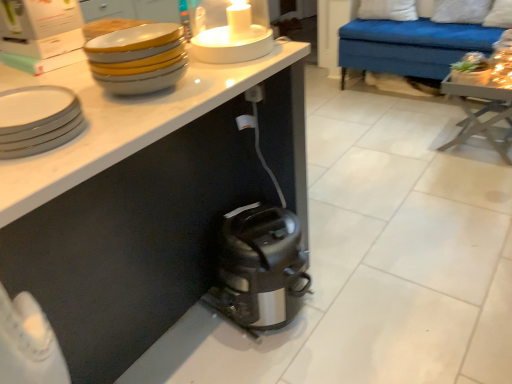
The height and width of the screenshot is (384, 512). In order to click on vacant space in front of wooden table at right in this screenshot , I will do `click(479, 174)`.